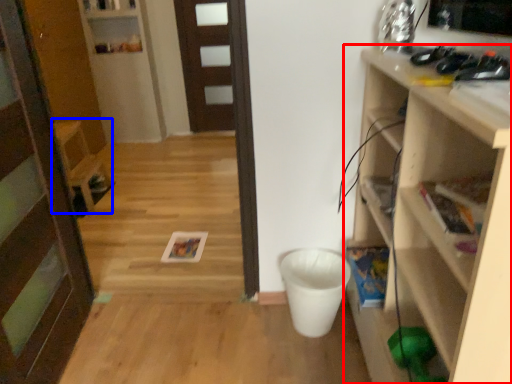
Question: Which point is further to the camera, shelf (highlighted by a red box) or chair (highlighted by a blue box)?

Choices:
 (A) shelf
 (B) chair

Answer: (B)